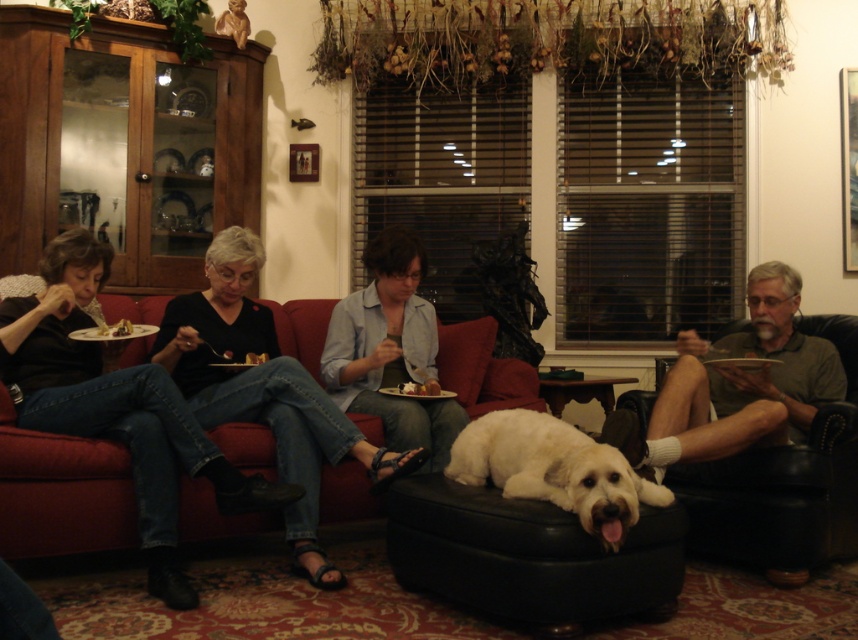
Who is taller, chocolate cake with frosting at center or chocolate cake at left?

chocolate cake with frosting at center

Is chocolate cake with frosting at center above chocolate cake at left?

No, chocolate cake with frosting at center is not above chocolate cake at left.

This screenshot has height=640, width=858. I want to click on chocolate cake with frosting at center, so click(420, 388).

Measure the distance between gray-green shirt at right and chocolate cake at left.

gray-green shirt at right is 6.68 feet from chocolate cake at left.

Who is shorter, gray-green shirt at right or chocolate cake at left?

Standing shorter between the two is chocolate cake at left.

Which is in front, point (603, 440) or point (104, 332)?

Point (603, 440)

Locate an element on the screen. gray-green shirt at right is located at coordinates (760, 365).

Can you confirm if black cotton shirt at center is positioned above gray-green shirt at right?

Actually, black cotton shirt at center is below gray-green shirt at right.

Based on the photo, between black cotton shirt at center and gray-green shirt at right, which one appears on the right side from the viewer's perspective?

gray-green shirt at right is more to the right.

Is point (233, 320) more distant than point (772, 301)?

Yes, it is.

You are a GUI agent. You are given a task and a screenshot of the screen. Output one action in this format:
    pyautogui.click(x=<x>, y=<y>)
    Task: Click on the black cotton shirt at center
    This screenshot has width=858, height=640.
    Given the screenshot: What is the action you would take?
    pyautogui.click(x=264, y=388)